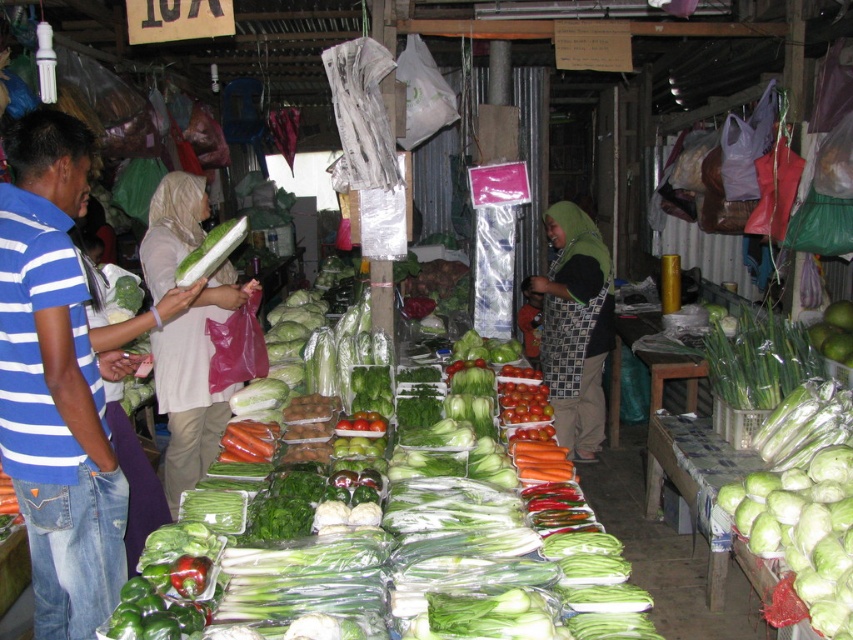
Does green leafy vegetables at center appear under matte green fabric at center?

Yes.

Does green leafy vegetables at center appear on the right side of matte green fabric at center?

No, green leafy vegetables at center is not to the right of matte green fabric at center.

Between point (595, 584) and point (531, 346), which one is positioned in front?

Point (595, 584)

Locate an element on the screen. green leafy vegetables at center is located at coordinates (531, 579).

Who is more distant from viewer, (196, 188) or (606, 284)?

Positioned behind is point (606, 284).

Is light beige fabric at center positioned before green fabric headscarf at center?

Yes, it is.

Who is more distant from viewer, (x=222, y=422) or (x=567, y=340)?

Positioned behind is point (x=567, y=340).

The width and height of the screenshot is (853, 640). Find the location of `light beige fabric at center`. light beige fabric at center is located at coordinates (x=193, y=384).

Which is below, green matte apple at center-right or matte green fabric at center?

green matte apple at center-right

Is point (831, 339) positioned in front of point (527, 333)?

Yes, it is.

Is point (817, 352) farther from viewer compared to point (537, 358)?

That is False.

At what (x,y) coordinates should I click in order to perform the action: click on green matte apple at center-right. Please return your answer as a coordinate pair (x, y). Looking at the image, I should click on (834, 332).